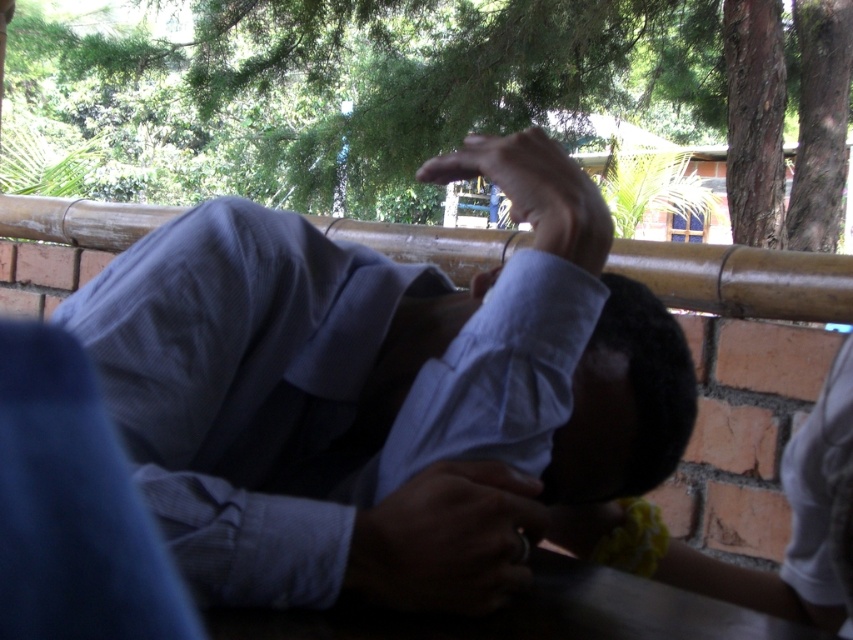
Question: Does metallic ring at lower center have a larger size compared to matte blue shirt at upper center?

Choices:
 (A) yes
 (B) no

Answer: (B)

Question: Which of these objects is positioned closest to the matte blue shirt at upper center?

Choices:
 (A) light blue shirt at center
 (B) metallic ring at lower center

Answer: (A)

Question: Can you confirm if light blue shirt at center is positioned to the left of metallic ring at lower center?

Choices:
 (A) no
 (B) yes

Answer: (B)

Question: Is metallic ring at lower center smaller than matte blue shirt at upper center?

Choices:
 (A) no
 (B) yes

Answer: (B)

Question: Which point appears farthest from the camera in this image?

Choices:
 (A) coord(521,205)
 (B) coord(619,480)

Answer: (B)

Question: Which object is the farthest from the light blue shirt at center?

Choices:
 (A) matte blue shirt at upper center
 (B) metallic ring at lower center

Answer: (A)